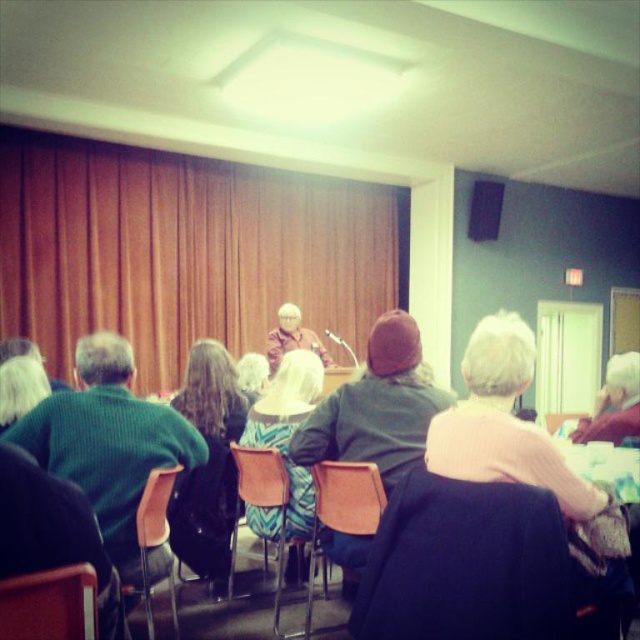
Question: Which of the following is the closest to the observer?

Choices:
 (A) (262, 490)
 (B) (333, 627)

Answer: (A)

Question: In this image, where is matte orange chair at lower left located relative to matte black speaker at upper center?

Choices:
 (A) left
 (B) right

Answer: (A)

Question: Which object is farther from the camera taking this photo?

Choices:
 (A) orange plastic chair at lower right
 (B) orange fabric chair at lower center

Answer: (A)

Question: Where is matte orange chair at lower left located in relation to white fabric at upper right in the image?

Choices:
 (A) left
 (B) right

Answer: (A)

Question: Among these objects, which one is nearest to the camera?

Choices:
 (A) dark green sweater at center
 (B) brown leather chair at center

Answer: (A)

Question: Observing the image, what is the correct spatial positioning of brown leather chair at center in reference to orange plastic chair at lower right?

Choices:
 (A) above
 (B) below

Answer: (B)